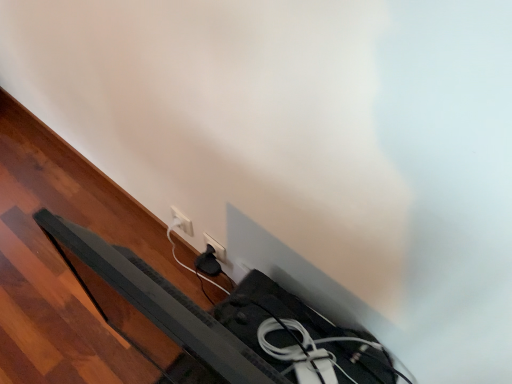
Question: Considering the positions of white plastic socket at lower center, which is counted as the first power plugs and sockets, starting from the left, and white plastic power plug at lower center, arranged as the second power plugs and sockets when viewed from the left, in the image, is white plastic socket at lower center, which is counted as the first power plugs and sockets, starting from the left, wider or thinner than white plastic power plug at lower center, arranged as the second power plugs and sockets when viewed from the left,?

Choices:
 (A) wide
 (B) thin

Answer: (B)

Question: Is white plastic socket at lower center, which is counted as the first power plugs and sockets, starting from the left, in front of or behind white plastic power plug at lower center, arranged as the second power plugs and sockets when viewed from the left, in the image?

Choices:
 (A) behind
 (B) front

Answer: (A)

Question: Which object is positioned closest to the white plastic socket at lower center, positioned as the second power plugs and sockets in right-to-left order?

Choices:
 (A) white plastic power plug at lower center, the first power plugs and sockets positioned from the right
 (B) black plastic bed frame at lower left

Answer: (A)

Question: Which is nearer to the black plastic bed frame at lower left?

Choices:
 (A) white plastic socket at lower center, positioned as the second power plugs and sockets in right-to-left order
 (B) white plastic power plug at lower center, arranged as the second power plugs and sockets when viewed from the left

Answer: (B)